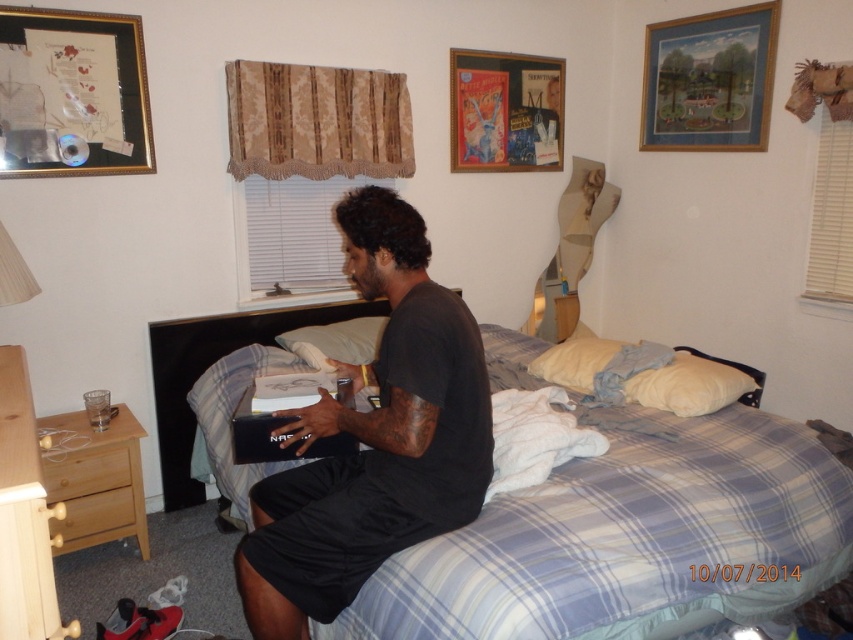
Can you confirm if wooden framed painting at upper right is smaller than light brown wood dresser at lower left?

Actually, wooden framed painting at upper right might be larger than light brown wood dresser at lower left.

I want to click on wooden framed painting at upper right, so click(x=709, y=81).

Does blue plaid fabric bed at center appear on the right side of white soft pillow at right?

Incorrect, blue plaid fabric bed at center is not on the right side of white soft pillow at right.

Who is higher up, blue plaid fabric bed at center or white soft pillow at right?

white soft pillow at right is above.

This screenshot has width=853, height=640. Identify the location of blue plaid fabric bed at center. (618, 534).

Image resolution: width=853 pixels, height=640 pixels. In order to click on blue plaid fabric bed at center in this screenshot , I will do `click(618, 534)`.

Which is more to the left, beech wood dresser at lower left or white soft pillow at center?

Positioned to the left is beech wood dresser at lower left.

Between beech wood dresser at lower left and white soft pillow at center, which one has less height?

white soft pillow at center

Locate an element on the screen. The image size is (853, 640). beech wood dresser at lower left is located at coordinates (96, 481).

Find the location of a particular element. This screenshot has width=853, height=640. beech wood dresser at lower left is located at coordinates (96, 481).